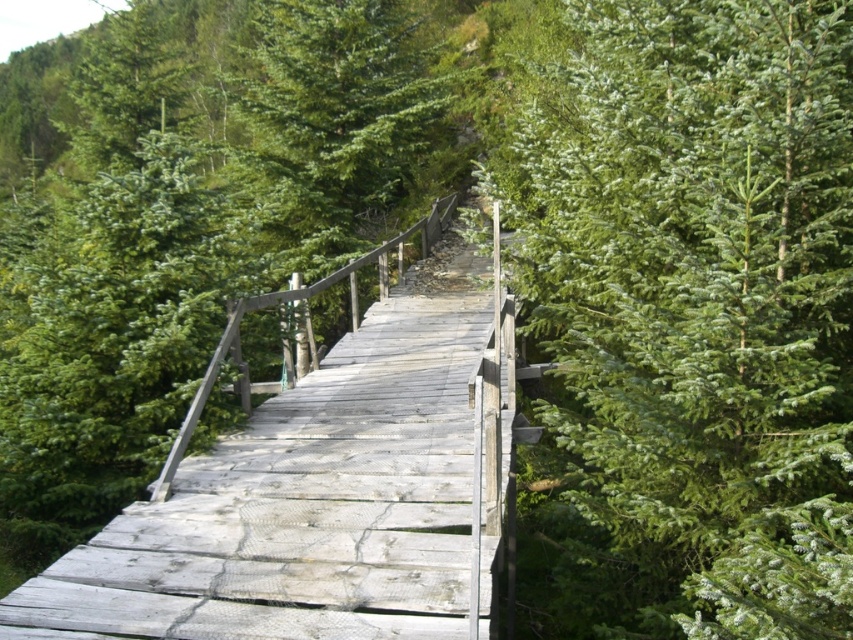
You are a hiker standing on the weathered wood bridge at center and looking towards the green matte tree at upper right. Which object is closer to you?

The weathered wood bridge at center is closer to you because you are standing on it, while the green matte tree at upper right is positioned over it, meaning it is further away.

You are standing on the weathered wood bridge at center and looking towards the green matte tree at upper right. Which object is closer to you?

The green matte tree at upper right is further away than the weathered wood bridge at center, so the weathered wood bridge at center is closer to you.